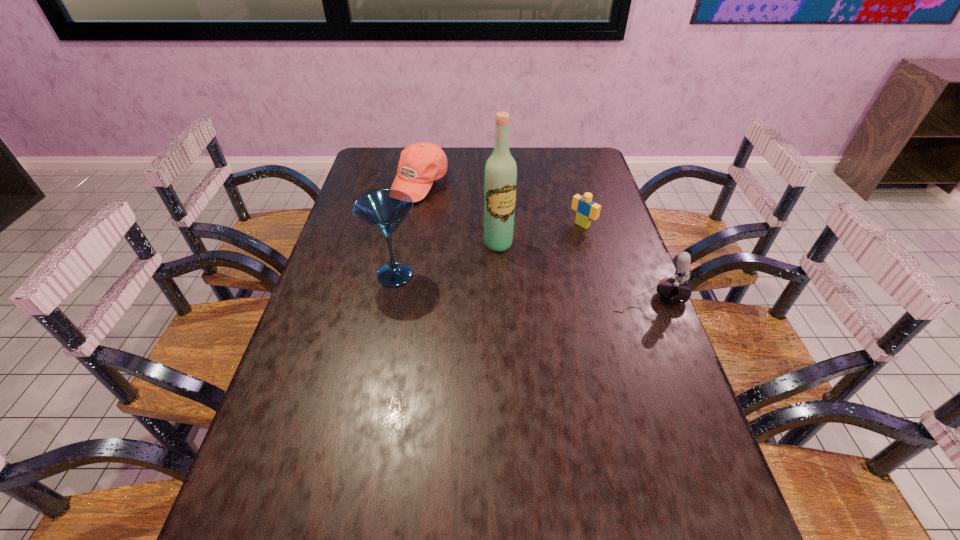
This screenshot has width=960, height=540. What are the coordinates of `martini` in the screenshot? It's located at (384, 210).

Identify the location of microphone. Image resolution: width=960 pixels, height=540 pixels. (674, 290).

Image resolution: width=960 pixels, height=540 pixels. Identify the location of baseball cap. (420, 164).

I want to click on wine bottle, so click(x=500, y=178).

Locate an element on the screen. Image resolution: width=960 pixels, height=540 pixels. the tallest object is located at coordinates (500, 178).

This screenshot has height=540, width=960. I want to click on Lego, so click(x=587, y=210).

Where is `the second farthest object`? This screenshot has height=540, width=960. the second farthest object is located at coordinates (587, 210).

Find the location of `vacant space located 0.170m on the right of the martini`. vacant space located 0.170m on the right of the martini is located at coordinates (481, 274).

Locate an element on the screen. This screenshot has width=960, height=540. free spot located 0.160m on the back of the microphone is located at coordinates (630, 249).

The height and width of the screenshot is (540, 960). What are the coordinates of `vacant region located 0.240m on the front-facing side of the baseball cap` in the screenshot? It's located at (471, 239).